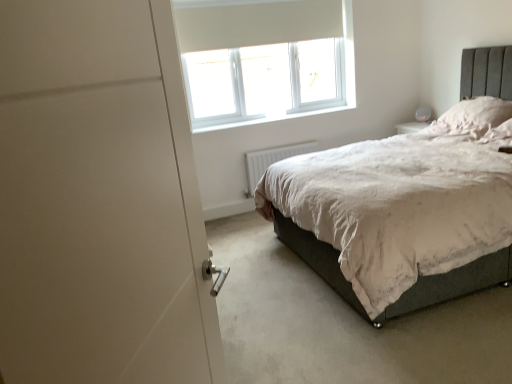
Question: Are white plastic window at upper center and white fluffy pillow at upper right making contact?

Choices:
 (A) no
 (B) yes

Answer: (A)

Question: From the image's perspective, is white plastic window at upper center on white fluffy pillow at upper right?

Choices:
 (A) no
 (B) yes

Answer: (B)

Question: Are white plastic window at upper center and white fluffy pillow at upper right far apart?

Choices:
 (A) yes
 (B) no

Answer: (A)

Question: Is white plastic window at upper center shorter than white fluffy pillow at upper right?

Choices:
 (A) yes
 (B) no

Answer: (B)

Question: Is white plastic window at upper center oriented away from white fluffy pillow at upper right?

Choices:
 (A) no
 (B) yes

Answer: (A)

Question: Visually, is white fluffy pillow at upper right positioned to the left or to the right of white plastic radiator at lower center?

Choices:
 (A) right
 (B) left

Answer: (A)

Question: From the image's perspective, is white fluffy pillow at upper right positioned above or below white plastic radiator at lower center?

Choices:
 (A) below
 (B) above

Answer: (B)

Question: Looking at their shapes, would you say white fluffy pillow at upper right is wider or thinner than white plastic radiator at lower center?

Choices:
 (A) thin
 (B) wide

Answer: (B)

Question: Choose the correct answer: Is white fluffy pillow at upper right inside white plastic radiator at lower center or outside it?

Choices:
 (A) outside
 (B) inside

Answer: (A)

Question: Considering their positions, is white fluffy pillow at upper right located in front of or behind white plastic window at upper center?

Choices:
 (A) behind
 (B) front

Answer: (B)

Question: Is white fluffy pillow at upper right bigger or smaller than white plastic window at upper center?

Choices:
 (A) small
 (B) big

Answer: (A)

Question: Looking at their shapes, would you say white fluffy pillow at upper right is wider or thinner than white plastic window at upper center?

Choices:
 (A) wide
 (B) thin

Answer: (A)

Question: In the image, is white fluffy pillow at upper right on the left side or the right side of white plastic window at upper center?

Choices:
 (A) right
 (B) left

Answer: (A)

Question: From the image's perspective, is white plastic window at upper center positioned above or below white fluffy pillow at upper right?

Choices:
 (A) below
 (B) above

Answer: (B)

Question: Relative to white fluffy pillow at upper right, is white plastic window at upper center in front or behind?

Choices:
 (A) behind
 (B) front

Answer: (A)